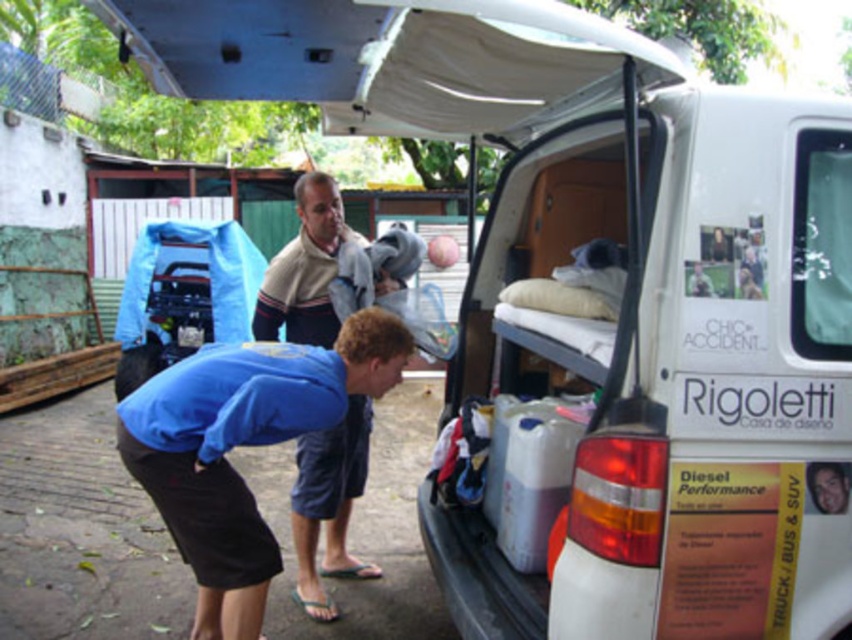
You are a delivery person trying to load a package into the van. You see the blue fabric shirt at lower left and the beige striped sweater at center. Which one is closer to the left side of the van?

The blue fabric shirt at lower left is closer to the left side of the van since it is positioned to the left of the beige striped sweater at center.

You are a photographer trying to capture a candid shot of both the blue fabric shirt at lower left and the beige striped sweater at center. Since you want to ensure both are fully visible in the frame, which clothing item requires more space horizontally in your camera viewfinder?

The blue fabric shirt at lower left requires more horizontal space in the camera viewfinder because its width is larger than the beige striped sweater at center.

You are standing at the point labeled as point (387, 344) and want to walk towards the van shown in the image. The van is 10 feet away from you. Can you safely walk straight to the van without any obstacles?

The point (387, 344) and the viewer are 9.93 feet apart, which is within the 10 feet distance. Since there are no obstacles mentioned in the scene description, you can safely walk straight to the van.